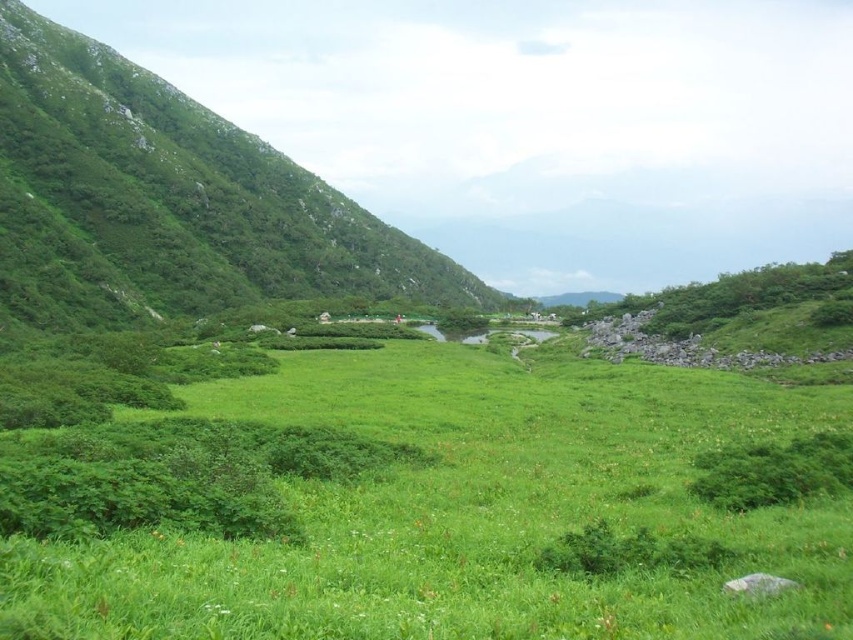
Between point (103, 472) and point (113, 163), which one is positioned in front?

Point (103, 472) is in front.

What do you see at coordinates (422, 506) in the screenshot? This screenshot has width=853, height=640. I see `green grassy field at center` at bounding box center [422, 506].

Who is more forward, (805, 605) or (345, 240)?

Positioned in front is point (805, 605).

This screenshot has width=853, height=640. What are the coordinates of `green grassy field at center` in the screenshot? It's located at (422, 506).